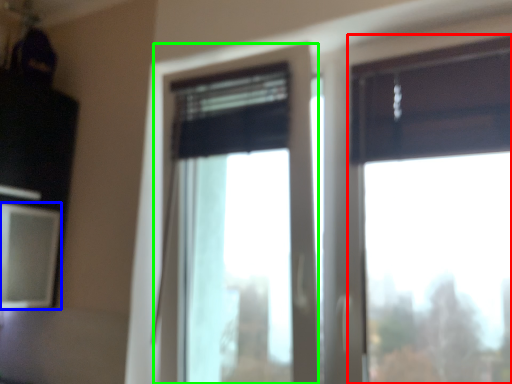
Question: Based on their relative distances, which object is nearer to window (highlighted by a red box)? Choose from window screen (highlighted by a blue box) and window (highlighted by a green box).

Choices:
 (A) window screen
 (B) window

Answer: (B)